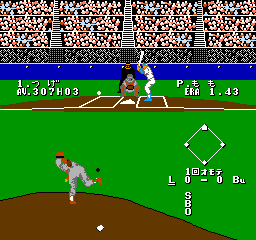
Locate an element on the screen. The width and height of the screenshot is (256, 240). blue divider is located at coordinates point(235,73), point(190,72), point(93,72), point(20,72).